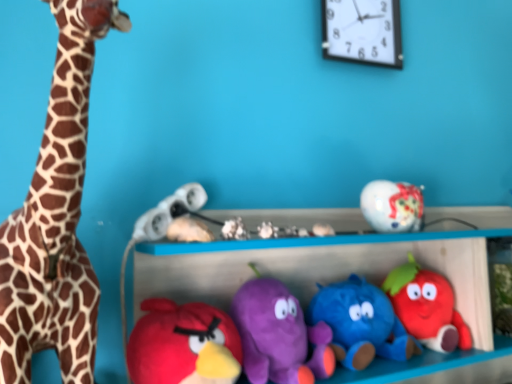
Question: From a real-world perspective, is white plush toy at center, marked as the sixth toy in a right-to-left arrangement, under matte white toy at center, which ranks as the second toy in left-to-right order?

Choices:
 (A) no
 (B) yes

Answer: (B)

Question: Would you say white plush toy at center, marked as the sixth toy in a right-to-left arrangement, contains matte white toy at center, which ranks as the 8th toy in right-to-left order?

Choices:
 (A) yes
 (B) no

Answer: (B)

Question: Would you consider white plush toy at center, the fourth toy in the left-to-right sequence, to be distant from matte white toy at center, which ranks as the second toy in left-to-right order?

Choices:
 (A) no
 (B) yes

Answer: (A)

Question: From the image's perspective, is white plush toy at center, the fourth toy in the left-to-right sequence, on top of matte white toy at center, which ranks as the 8th toy in right-to-left order?

Choices:
 (A) no
 (B) yes

Answer: (B)

Question: Can you confirm if white plush toy at center, marked as the sixth toy in a right-to-left arrangement, is positioned to the right of matte white toy at center, which ranks as the second toy in left-to-right order?

Choices:
 (A) no
 (B) yes

Answer: (B)

Question: Is white plush toy at center, the fourth toy in the left-to-right sequence, turned away from matte white toy at center, which ranks as the second toy in left-to-right order?

Choices:
 (A) no
 (B) yes

Answer: (A)

Question: Considering the relative sizes of spotted fur giraffe at left and white matte seashell at center, the 5th toy from the left, in the image provided, is spotted fur giraffe at left wider than white matte seashell at center, the 5th toy from the left,?

Choices:
 (A) no
 (B) yes

Answer: (B)

Question: Would you say spotted fur giraffe at left is outside white matte seashell at center, the 5th toy from the left?

Choices:
 (A) no
 (B) yes

Answer: (B)

Question: From the image's perspective, is spotted fur giraffe at left on white matte seashell at center, which appears as the fifth toy when viewed from the right?

Choices:
 (A) yes
 (B) no

Answer: (A)

Question: Could you tell me if spotted fur giraffe at left is turned towards white matte seashell at center, the 5th toy from the left?

Choices:
 (A) no
 (B) yes

Answer: (A)

Question: Considering the relative sizes of spotted fur giraffe at left and white matte seashell at center, which appears as the fifth toy when viewed from the right, in the image provided, is spotted fur giraffe at left bigger than white matte seashell at center, which appears as the fifth toy when viewed from the right,?

Choices:
 (A) yes
 (B) no

Answer: (A)

Question: Is spotted fur giraffe at left positioned with its back to white matte seashell at center, the 5th toy from the left?

Choices:
 (A) no
 (B) yes

Answer: (A)

Question: Does matte white toy at center, which ranks as the second toy in left-to-right order, have a greater height compared to soft plush strawberry at center right, which ranks as the ninth toy in left-to-right order?

Choices:
 (A) no
 (B) yes

Answer: (A)